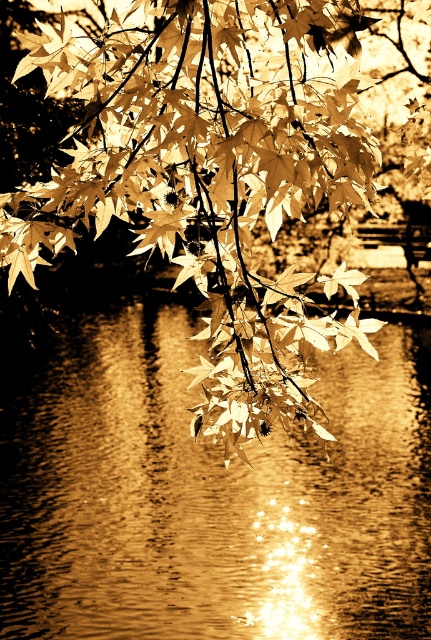
You are standing at the point marked as point (93, 220) in the image. There is a golden maple leaf exactly 18.20 meters away from you. Which direction should you walk to reach the leaf?

The golden maple leaf is 18.20 meters away from point (93, 220). Since the scene is a serene autumnal setting with a branch extending diagonally across the frame, the direction would depend on the leafs position relative to the branch, but the exact direction cannot be determined without additional spatial information.

You are standing in the autumn scene and want to place a small stone on the shiny reflective water at center. However, you want to ensure it won not hit the golden textured maple leaf at center. Can you do this without the stone touching the leaf?

Yes, because the shiny reflective water at center is located below the golden textured maple leaf at center, so placing the stone on the water won will not cause it to touch the leaf.